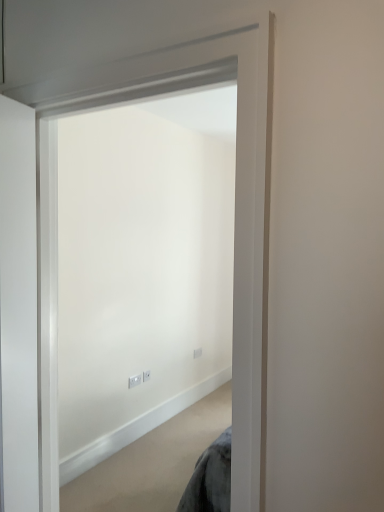
You are a GUI agent. You are given a task and a screenshot of the screen. Output one action in this format:
    pyautogui.click(x=<x>, y=<y>)
    Task: Click on the white plastic electric outlet at center, the third electric outlet from the back
    
    Given the screenshot: What is the action you would take?
    pyautogui.click(x=134, y=381)

The height and width of the screenshot is (512, 384). Describe the element at coordinates (197, 353) in the screenshot. I see `white plastic electric outlet at center, the first electric outlet from the back` at that location.

Where is `white plastic electric outlet at center, the third electric outlet viewed from the right`? The image size is (384, 512). white plastic electric outlet at center, the third electric outlet viewed from the right is located at coordinates (134, 381).

Would you say white plastic electric outlet at center, the 2th electric outlet from the left, is to the left or to the right of white matte door at center in the picture?

Based on their positions, white plastic electric outlet at center, the 2th electric outlet from the left, is located to the left of white matte door at center.

Considering the positions of objects white plastic electric outlet at center, placed as the second electric outlet when sorted from right to left, and white matte door at center in the image provided, who is in front, white plastic electric outlet at center, placed as the second electric outlet when sorted from right to left, or white matte door at center?

white matte door at center is in front.

Is white plastic electric outlet at center, the 2th electric outlet from the left, not within white matte door at center?

white plastic electric outlet at center, the 2th electric outlet from the left, lies outside white matte door at center's area.

Between white plastic electric outlet at center, the 2th electric outlet from the left, and white matte door at center, which one has smaller width?

With smaller width is white plastic electric outlet at center, the 2th electric outlet from the left.

From a real-world perspective, is white plastic electric outlet at center, which is counted as the 1th electric outlet, starting from the left, positioned under white matte door at center based on gravity?

Indeed, from a real-world perspective, white plastic electric outlet at center, which is counted as the 1th electric outlet, starting from the left, is positioned beneath white matte door at center.

Which is farther from the camera, (136,378) or (67,397)?

Point (136,378)

Considering the relative sizes of white plastic electric outlet at center, the first electric outlet when ordered from front to back, and white matte door at center in the image provided, is white plastic electric outlet at center, the first electric outlet when ordered from front to back, wider than white matte door at center?

No.

Does white plastic electric outlet at center, which is counted as the 1th electric outlet, starting from the left, turn towards white matte door at center?

No, white plastic electric outlet at center, which is counted as the 1th electric outlet, starting from the left, does not turn towards white matte door at center.

Is white plastic electric outlet at center, the second electric outlet when ordered from back to front, turned away from white plastic electric outlet at center, the 3th electric outlet in the front-to-back sequence?

No.

Are white plastic electric outlet at center, the second electric outlet positioned from the front, and white plastic electric outlet at center, the first electric outlet from the back, located far from each other?

white plastic electric outlet at center, the second electric outlet positioned from the front, is actually quite close to white plastic electric outlet at center, the first electric outlet from the back.

Does white plastic electric outlet at center, the second electric outlet positioned from the front, come behind white plastic electric outlet at center, the first electric outlet from the back?

No, it is in front of white plastic electric outlet at center, the first electric outlet from the back.

In the scene shown: Is white plastic electric outlet at center, the 2th electric outlet from the left, bigger or smaller than white plastic electric outlet at center, the third electric outlet from the left?

Clearly, white plastic electric outlet at center, the 2th electric outlet from the left, is smaller in size than white plastic electric outlet at center, the third electric outlet from the left.

Looking at this image, is white plastic electric outlet at center, the third electric outlet from the back, positioned with its back to white plastic electric outlet at center, the 3th electric outlet in the front-to-back sequence?

No.

Is point (136, 375) positioned in front of point (198, 352)?

Yes.

Is white plastic electric outlet at center, the first electric outlet when ordered from front to back, taller or shorter than white plastic electric outlet at center, marked as the 1th electric outlet in a right-to-left arrangement?

Considering their sizes, white plastic electric outlet at center, the first electric outlet when ordered from front to back, has less height than white plastic electric outlet at center, marked as the 1th electric outlet in a right-to-left arrangement.

Which object is closer to the camera, white plastic electric outlet at center, which is counted as the 1th electric outlet, starting from the left, or white plastic electric outlet at center, marked as the 1th electric outlet in a right-to-left arrangement?

white plastic electric outlet at center, which is counted as the 1th electric outlet, starting from the left.

How different are the orientations of white plastic electric outlet at center, marked as the 1th electric outlet in a right-to-left arrangement, and white plastic electric outlet at center, the second electric outlet positioned from the front, in degrees?

The angle between the facing direction of white plastic electric outlet at center, marked as the 1th electric outlet in a right-to-left arrangement, and the facing direction of white plastic electric outlet at center, the second electric outlet positioned from the front, is 0.0689 degrees.

Considering the relative sizes of white plastic electric outlet at center, the third electric outlet from the left, and white plastic electric outlet at center, the second electric outlet positioned from the front, in the image provided, is white plastic electric outlet at center, the third electric outlet from the left, bigger than white plastic electric outlet at center, the second electric outlet positioned from the front,?

Indeed, white plastic electric outlet at center, the third electric outlet from the left, has a larger size compared to white plastic electric outlet at center, the second electric outlet positioned from the front.

Between white plastic electric outlet at center, the third electric outlet from the left, and white plastic electric outlet at center, the 2th electric outlet from the left, which one is positioned in front?

white plastic electric outlet at center, the 2th electric outlet from the left, is closer to the camera.

Is white plastic electric outlet at center, the third electric outlet from the left, not inside white plastic electric outlet at center, the 2th electric outlet from the left?

Indeed, white plastic electric outlet at center, the third electric outlet from the left, is completely outside white plastic electric outlet at center, the 2th electric outlet from the left.

From the image's perspective, does white matte door at center appear lower than white plastic electric outlet at center, the second electric outlet when ordered from back to front?

Actually, white matte door at center appears above white plastic electric outlet at center, the second electric outlet when ordered from back to front, in the image.

Based on their sizes in the image, would you say white matte door at center is bigger or smaller than white plastic electric outlet at center, placed as the second electric outlet when sorted from right to left?

Considering their sizes, white matte door at center takes up more space than white plastic electric outlet at center, placed as the second electric outlet when sorted from right to left.

Can white plastic electric outlet at center, the second electric outlet positioned from the front, be found inside white matte door at center?

No, white plastic electric outlet at center, the second electric outlet positioned from the front, is not a part of white matte door at center.

From a real-world perspective, is white plastic electric outlet at center, the 3th electric outlet in the front-to-back sequence, over white plastic electric outlet at center, the third electric outlet viewed from the right?

Correct, in the physical world, white plastic electric outlet at center, the 3th electric outlet in the front-to-back sequence, is higher than white plastic electric outlet at center, the third electric outlet viewed from the right.

Considering the sizes of objects white plastic electric outlet at center, the third electric outlet from the left, and white plastic electric outlet at center, the first electric outlet when ordered from front to back, in the image provided, who is wider, white plastic electric outlet at center, the third electric outlet from the left, or white plastic electric outlet at center, the first electric outlet when ordered from front to back,?

Wider between the two is white plastic electric outlet at center, the first electric outlet when ordered from front to back.

Would you consider white plastic electric outlet at center, the third electric outlet from the left, to be distant from white plastic electric outlet at center, which is counted as the 1th electric outlet, starting from the left?

white plastic electric outlet at center, the third electric outlet from the left, is near white plastic electric outlet at center, which is counted as the 1th electric outlet, starting from the left, not far away.

At what (x,y) coordinates should I click in order to perform the action: click on electric outlet that is the 2nd object located below the white matte door at center (from the image's perspective). Please return your answer as a coordinate pair (x, y). Looking at the image, I should click on 146,375.

The height and width of the screenshot is (512, 384). Identify the location of the 2nd electric outlet to the left of the white matte door at center, counting from the anchor's position. (134, 381).

Which object lies nearer to the anchor point white plastic electric outlet at center, the third electric outlet viewed from the right, white matte door at center or white plastic electric outlet at center, the 3th electric outlet in the front-to-back sequence?

white plastic electric outlet at center, the 3th electric outlet in the front-to-back sequence.

From the picture: Which object lies nearer to the anchor point white plastic electric outlet at center, the second electric outlet positioned from the front, white matte door at center or white plastic electric outlet at center, the third electric outlet viewed from the right?

white plastic electric outlet at center, the third electric outlet viewed from the right, is positioned closer to the anchor white plastic electric outlet at center, the second electric outlet positioned from the front.

Based on their spatial positions, is white plastic electric outlet at center, the third electric outlet from the back, or white matte door at center further from white plastic electric outlet at center, the first electric outlet from the back?

white matte door at center is further to white plastic electric outlet at center, the first electric outlet from the back.

Which object lies further to the anchor point white plastic electric outlet at center, which is counted as the 1th electric outlet, starting from the left, white plastic electric outlet at center, marked as the 1th electric outlet in a right-to-left arrangement, or white matte door at center?

The object further to white plastic electric outlet at center, which is counted as the 1th electric outlet, starting from the left, is white matte door at center.

Based on their spatial positions, is white plastic electric outlet at center, placed as the second electric outlet when sorted from right to left, or white matte door at center further from white plastic electric outlet at center, the first electric outlet from the back?

white matte door at center is positioned further to the anchor white plastic electric outlet at center, the first electric outlet from the back.

Looking at the image, which one is located closer to white plastic electric outlet at center, the first electric outlet when ordered from front to back, white matte door at center or white plastic electric outlet at center, the second electric outlet when ordered from back to front?

The object closer to white plastic electric outlet at center, the first electric outlet when ordered from front to back, is white plastic electric outlet at center, the second electric outlet when ordered from back to front.

Considering their positions, is white plastic electric outlet at center, the first electric outlet from the back, positioned closer to white plastic electric outlet at center, placed as the second electric outlet when sorted from right to left, than white plastic electric outlet at center, the third electric outlet viewed from the right?

Based on the image, white plastic electric outlet at center, the third electric outlet viewed from the right, appears to be nearer to white plastic electric outlet at center, placed as the second electric outlet when sorted from right to left.

From the image, which object appears to be nearer to white plastic electric outlet at center, the third electric outlet from the left, white matte door at center or white plastic electric outlet at center, the second electric outlet positioned from the front?

The object closer to white plastic electric outlet at center, the third electric outlet from the left, is white plastic electric outlet at center, the second electric outlet positioned from the front.

Where is `electric outlet positioned between white matte door at center and white plastic electric outlet at center, the second electric outlet when ordered from back to front, from near to far`? electric outlet positioned between white matte door at center and white plastic electric outlet at center, the second electric outlet when ordered from back to front, from near to far is located at coordinates (134, 381).

In order to click on electric outlet located between white plastic electric outlet at center, the third electric outlet viewed from the right, and white plastic electric outlet at center, the 3th electric outlet in the front-to-back sequence, in the depth direction in this screenshot , I will do `click(146, 375)`.